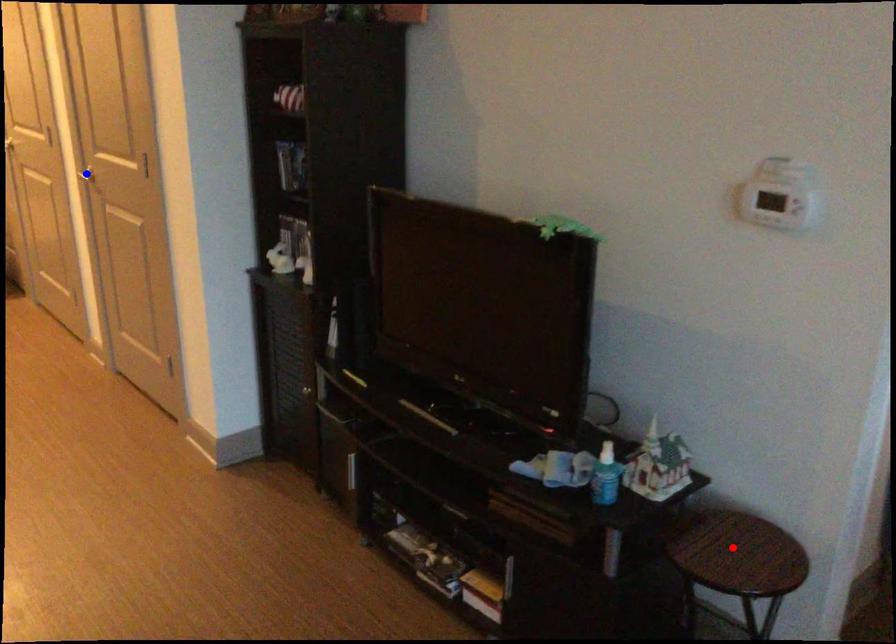
Question: Two points are marked on the image. Which point is closer to the camera?

Choices:
 (A) Blue point is closer.
 (B) Red point is closer.

Answer: (B)